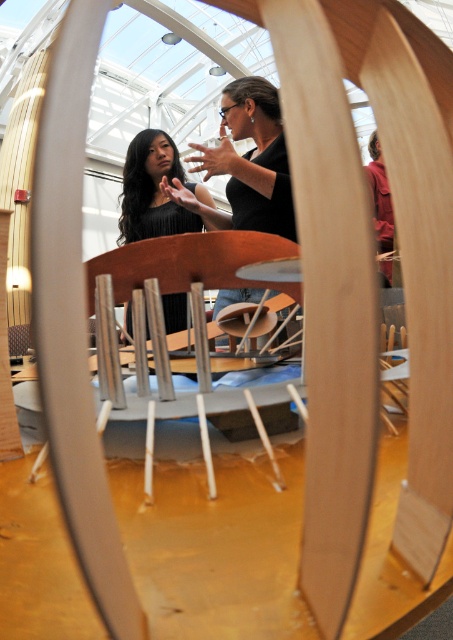
Between point (276, 129) and point (129, 307), which one is positioned in front?

Positioned in front is point (276, 129).

Does black matte shirt at center lie behind black matte dress at center?

No, it is in front of black matte dress at center.

Image resolution: width=453 pixels, height=640 pixels. Describe the element at coordinates (251, 157) in the screenshot. I see `black matte shirt at center` at that location.

Where is `black matte shirt at center`? black matte shirt at center is located at coordinates (251, 157).